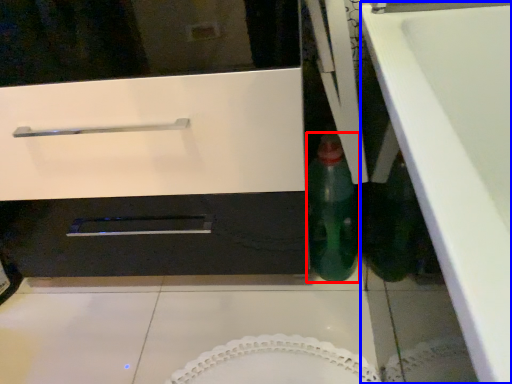
Question: Among these objects, which one is nearest to the camera, bottle (highlighted by a red box) or counter top (highlighted by a blue box)?

Choices:
 (A) bottle
 (B) counter top

Answer: (B)